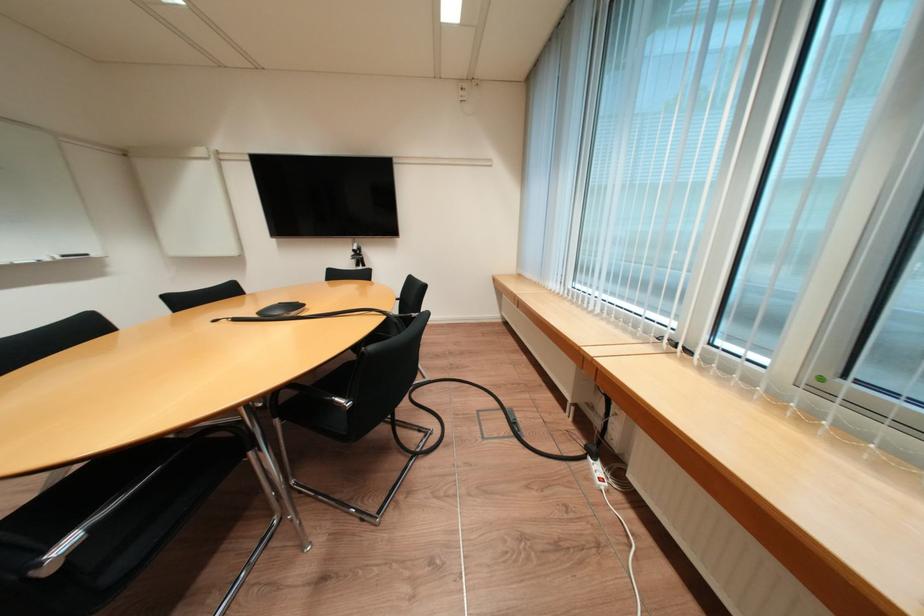
You are a GUI agent. You are given a task and a screenshot of the screen. Output one action in this format:
    pyautogui.click(x=<x>, y=<y>)
    Task: Click on the white blind chain
    This screenshot has width=924, height=616.
    Given the screenshot: What is the action you would take?
    pyautogui.click(x=735, y=28)